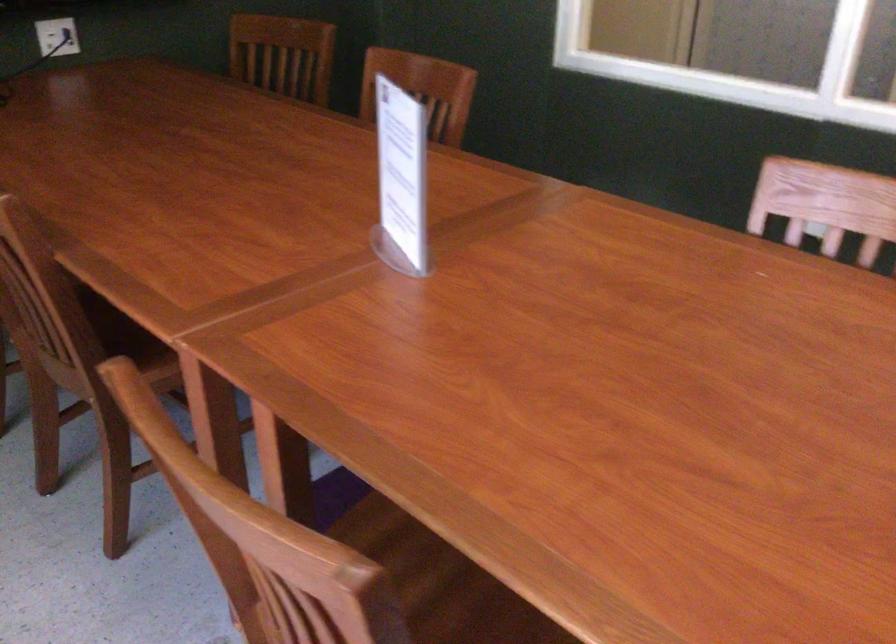
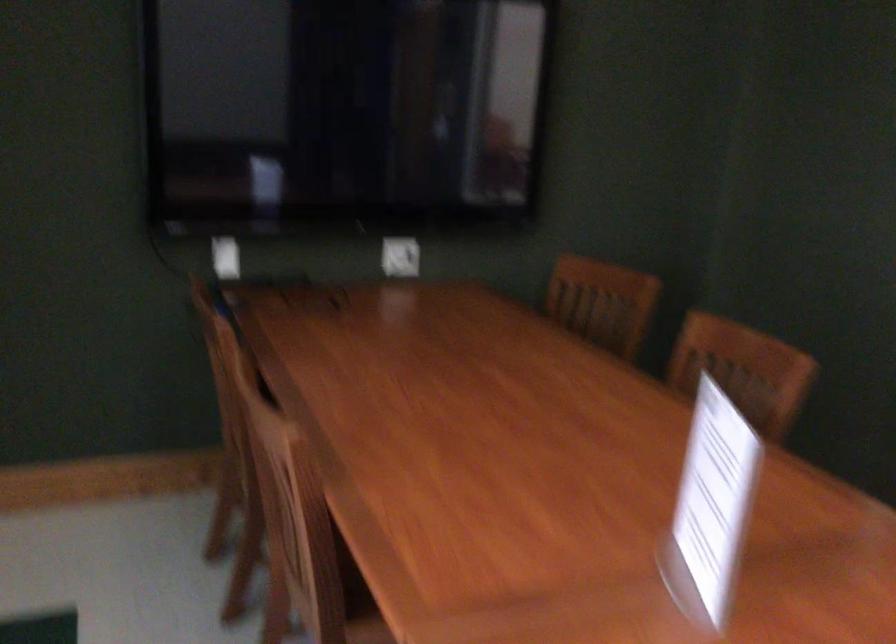
Which direction would the cameraman need to move to produce the second image?

The cameraman walked toward left, forward.